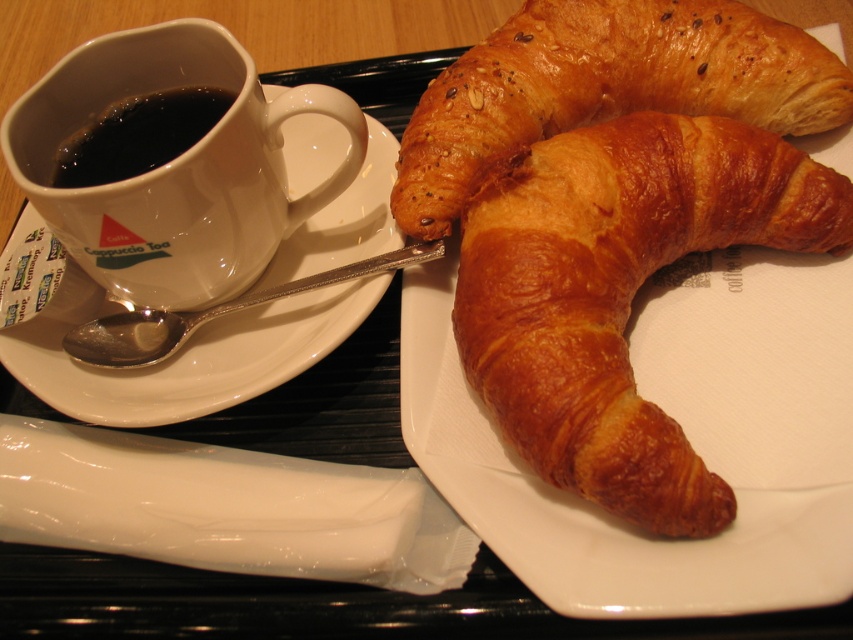
Question: Is golden brown flaky croissant at center positioned behind white ceramic saucer at left?

Choices:
 (A) yes
 (B) no

Answer: (B)

Question: Can you confirm if golden brown flaky croissant at center is positioned to the right of black matte cup at upper left?

Choices:
 (A) no
 (B) yes

Answer: (B)

Question: Which of the following is the closest to the observer?

Choices:
 (A) (300, 138)
 (B) (573, 161)
 (C) (161, 148)
 (D) (813, 45)

Answer: (B)

Question: Which object is positioned closest to the golden brown flaky croissant at upper right?

Choices:
 (A) black matte cup at upper left
 (B) white ceramic saucer at left
 (C) golden brown flaky croissant at center

Answer: (C)

Question: Does golden brown flaky croissant at upper right lie behind white ceramic saucer at left?

Choices:
 (A) yes
 (B) no

Answer: (B)

Question: Which object is positioned closest to the white ceramic saucer at left?

Choices:
 (A) golden brown flaky croissant at center
 (B) golden brown flaky croissant at upper right
 (C) black matte cup at upper left

Answer: (C)